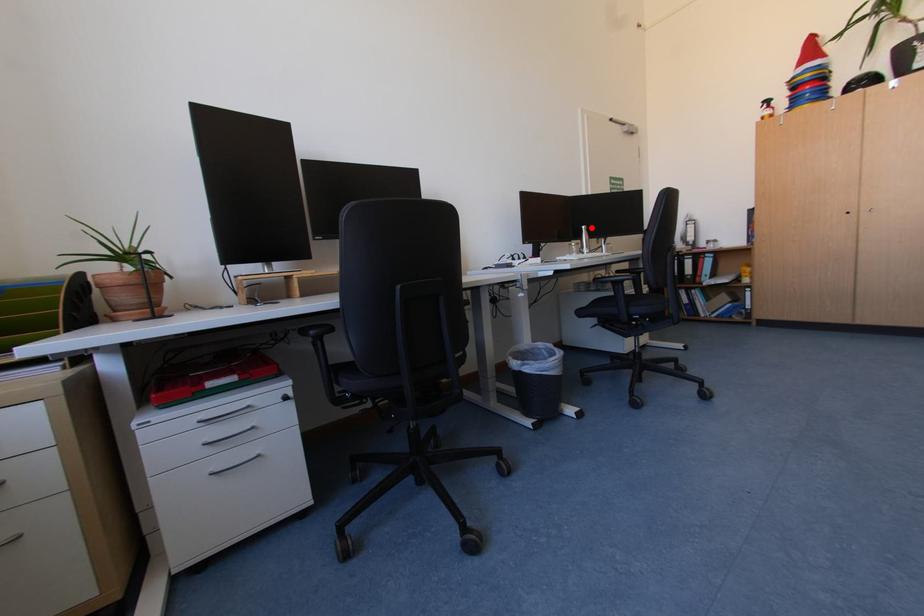
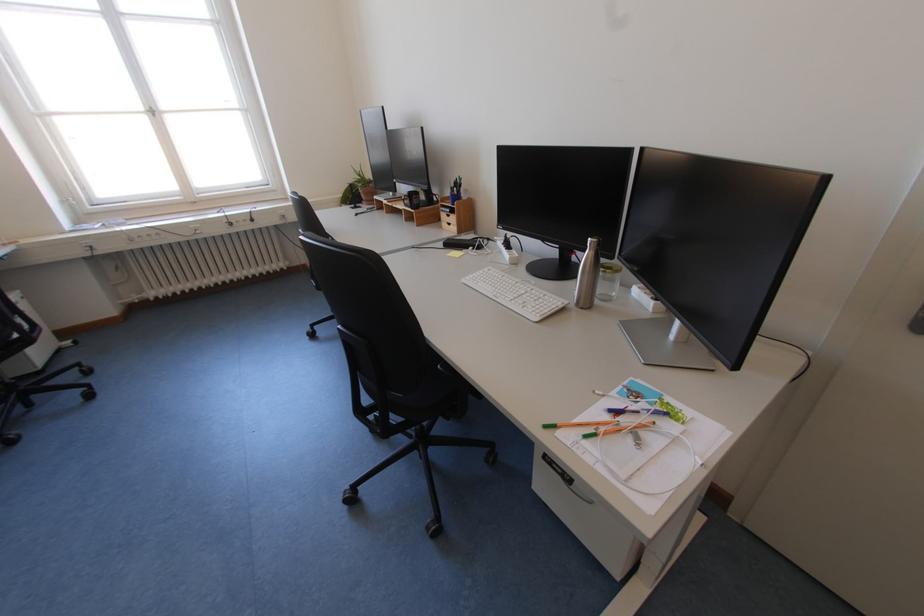
The point at the highlighted location is marked in the first image. Where is the corresponding point in the second image?

(599, 240)